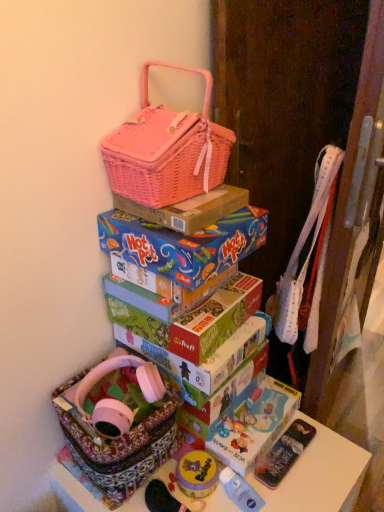
The height and width of the screenshot is (512, 384). I want to click on pink wicker basket at upper center, which is the first box in top-to-bottom order, so click(189, 209).

What do you see at coordinates (167, 151) in the screenshot? I see `pink wicker basket at upper center` at bounding box center [167, 151].

This screenshot has height=512, width=384. What do you see at coordinates (183, 244) in the screenshot?
I see `blue cardboard hot pot box at center, placed as the 1th box when sorted from bottom to top` at bounding box center [183, 244].

Locate an element on the screen. The width and height of the screenshot is (384, 512). pink wicker basket at upper center, which is the first box in top-to-bottom order is located at coordinates (189, 209).

The width and height of the screenshot is (384, 512). I want to click on box that appears on the right of pink wicker basket at upper center, which is the first box in top-to-bottom order, so click(183, 244).

Is blue cardboard hot pot box at center, placed as the 1th box when sorted from bottom to top, wider or thinner than pink wicker basket at upper center, which is the first box in top-to-bottom order?

blue cardboard hot pot box at center, placed as the 1th box when sorted from bottom to top, is wider than pink wicker basket at upper center, which is the first box in top-to-bottom order.

From the picture: Is blue cardboard hot pot box at center, which appears as the second box when viewed from the top, inside or outside of pink wicker basket at upper center, the second box positioned from the bottom?

blue cardboard hot pot box at center, which appears as the second box when viewed from the top, is not inside pink wicker basket at upper center, the second box positioned from the bottom, it's outside.

Consider the image. From a real-world perspective, is blue cardboard hot pot box at center, which appears as the second box when viewed from the top, physically below pink wicker basket at upper center, the second box positioned from the bottom?

Yes, from a real-world perspective, blue cardboard hot pot box at center, which appears as the second box when viewed from the top, is below pink wicker basket at upper center, the second box positioned from the bottom.

From the image's perspective, is blue cardboard hot pot box at center, placed as the 1th box when sorted from bottom to top, above patterned fabric basket at lower left?

Yes.

Which object is closer to the camera, blue cardboard hot pot box at center, which appears as the second box when viewed from the top, or patterned fabric basket at lower left?

patterned fabric basket at lower left is closer to the camera.

Looking at this image, can you see blue cardboard hot pot box at center, which appears as the second box when viewed from the top, touching patterned fabric basket at lower left?

No, blue cardboard hot pot box at center, which appears as the second box when viewed from the top, is not with patterned fabric basket at lower left.

Which of these two, blue cardboard hot pot box at center, which appears as the second box when viewed from the top, or patterned fabric basket at lower left, stands shorter?

With less height is blue cardboard hot pot box at center, which appears as the second box when viewed from the top.

Which point is more forward, (168, 147) or (262, 216)?

Positioned in front is point (168, 147).

Is pink wicker basket at upper center behind blue cardboard hot pot box at center, which appears as the second box when viewed from the top?

No.

From a real-world perspective, which is physically below, patterned fabric basket at lower left or matte plastic toy at lower center?

patterned fabric basket at lower left is physically lower.

Which object is positioned more to the left, patterned fabric basket at lower left or matte plastic toy at lower center?

patterned fabric basket at lower left.

In the scene shown: Is patterned fabric basket at lower left closer to the viewer compared to matte plastic toy at lower center?

Yes, patterned fabric basket at lower left is in front of matte plastic toy at lower center.

What's the angular difference between patterned fabric basket at lower left and matte plastic toy at lower center's facing directions?

The angular difference between patterned fabric basket at lower left and matte plastic toy at lower center is 0.00222 degrees.

Which is nearer, (146, 207) or (225, 490)?

Point (146, 207) is positioned closer to the camera compared to point (225, 490).

Is pink wicker basket at upper center, which is the first box in top-to-bottom order, aimed at matte plastic toy at lower center?

No, pink wicker basket at upper center, which is the first box in top-to-bottom order, is not oriented towards matte plastic toy at lower center.

Which of these two, pink wicker basket at upper center, the second box positioned from the bottom, or matte plastic toy at lower center, is wider?

Wider between the two is pink wicker basket at upper center, the second box positioned from the bottom.

Considering the points (174, 233) and (248, 509), which point is behind, point (174, 233) or point (248, 509)?

Point (248, 509)

From a real-world perspective, between blue cardboard hot pot box at center, placed as the 1th box when sorted from bottom to top, and matte plastic toy at lower center, who is vertically higher?

blue cardboard hot pot box at center, placed as the 1th box when sorted from bottom to top.

Is blue cardboard hot pot box at center, placed as the 1th box when sorted from bottom to top, positioned far away from matte plastic toy at lower center?

blue cardboard hot pot box at center, placed as the 1th box when sorted from bottom to top, is actually quite close to matte plastic toy at lower center.

Would you say blue cardboard hot pot box at center, placed as the 1th box when sorted from bottom to top, is outside matte plastic toy at lower center?

Yes, blue cardboard hot pot box at center, placed as the 1th box when sorted from bottom to top, is not within matte plastic toy at lower center.

Who is taller, floral fabric basket at lower left or pink wicker basket at upper center?

floral fabric basket at lower left.

Which of these two, floral fabric basket at lower left or pink wicker basket at upper center, is bigger?

With larger size is floral fabric basket at lower left.

Identify the location of gift basket below the pink wicker basket at upper center (from the image's perspective). This screenshot has height=512, width=384. (118, 424).

From a real-world perspective, relative to pink wicker basket at upper center, is floral fabric basket at lower left vertically above or below?

floral fabric basket at lower left is below pink wicker basket at upper center.

Find the location of a particular element. box that is on the left side of blue cardboard hot pot box at center, which appears as the second box when viewed from the top is located at coordinates (189, 209).

Locate an element on the screen. table in front of the blue cardboard hot pot box at center, placed as the 1th box when sorted from bottom to top is located at coordinates (319, 475).

From the image, which object appears to be nearer to floral fabric basket at lower left, patterned fabric basket at lower left or matte plastic toy at lower center?

patterned fabric basket at lower left lies closer to floral fabric basket at lower left than the other object.

Based on their spatial positions, is patterned fabric basket at lower left or blue cardboard hot pot box at center, placed as the 1th box when sorted from bottom to top, further from floral fabric basket at lower left?

blue cardboard hot pot box at center, placed as the 1th box when sorted from bottom to top.

Consider the image. Based on their spatial positions, is patterned fabric basket at lower left or pink wicker basket at upper center further from pink wicker basket at upper center, which is the first box in top-to-bottom order?

patterned fabric basket at lower left.

Looking at the image, which one is located closer to pink wicker basket at upper center, matte plastic toy at lower center or floral fabric basket at lower left?

The object closer to pink wicker basket at upper center is floral fabric basket at lower left.

Looking at the image, which one is located closer to pink wicker basket at upper center, the second box positioned from the bottom, floral fabric basket at lower left or blue cardboard hot pot box at center, which appears as the second box when viewed from the top?

The object closer to pink wicker basket at upper center, the second box positioned from the bottom, is blue cardboard hot pot box at center, which appears as the second box when viewed from the top.

From the image, which object appears to be farther from blue cardboard hot pot box at center, which appears as the second box when viewed from the top, patterned fabric basket at lower left or pink wicker basket at upper center, the second box positioned from the bottom?

The object further to blue cardboard hot pot box at center, which appears as the second box when viewed from the top, is patterned fabric basket at lower left.

When comparing their distances from patterned fabric basket at lower left, does pink wicker basket at upper center or pink wicker basket at upper center, the second box positioned from the bottom, seem further?

pink wicker basket at upper center.

Looking at the image, which one is located closer to matte plastic toy at lower center, pink wicker basket at upper center or patterned fabric basket at lower left?

patterned fabric basket at lower left is closer to matte plastic toy at lower center.

Identify the location of box between pink wicker basket at upper center, which is the first box in top-to-bottom order, and matte plastic toy at lower center in the up-down direction. (183, 244).

Identify the location of box between pink wicker basket at upper center, which is the first box in top-to-bottom order, and floral fabric basket at lower left from top to bottom. This screenshot has width=384, height=512. (183, 244).

Locate an element on the screen. gift basket that lies between blue cardboard hot pot box at center, which appears as the second box when viewed from the top, and matte plastic toy at lower center from top to bottom is located at coordinates 118,424.

You are a GUI agent. You are given a task and a screenshot of the screen. Output one action in this format:
    pyautogui.click(x=<x>, y=<y>)
    Task: Click on the gift basket that lies between pink wicker basket at upper center, which is the first box in top-to-bottom order, and matte plastic toy at lower center from top to bottom
    
    Given the screenshot: What is the action you would take?
    pos(118,424)